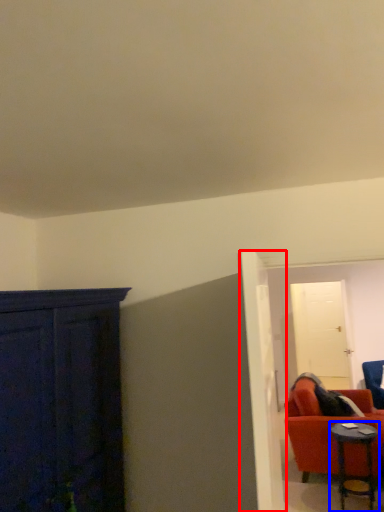
Question: Which object is closer to the camera taking this photo, door (highlighted by a red box) or table (highlighted by a blue box)?

Choices:
 (A) door
 (B) table

Answer: (A)